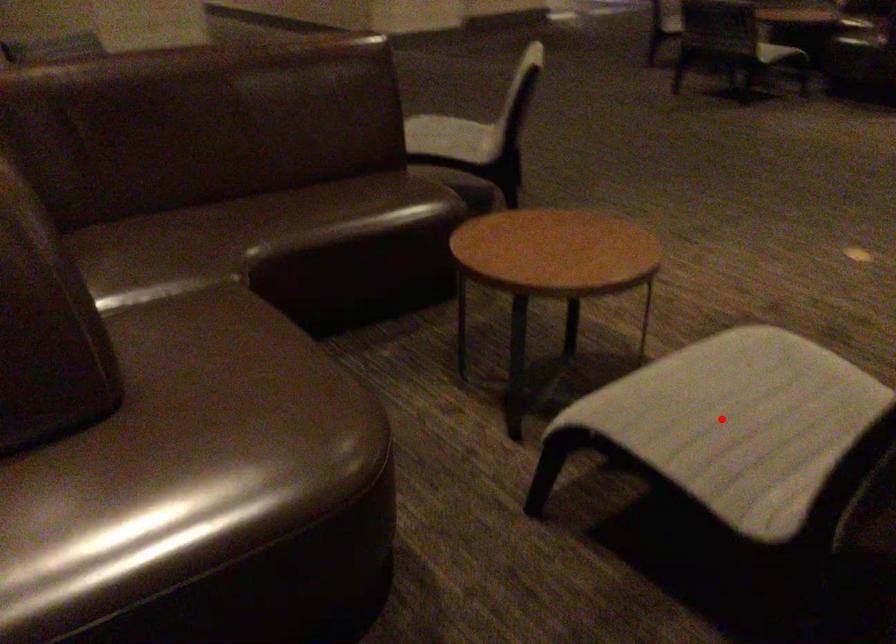
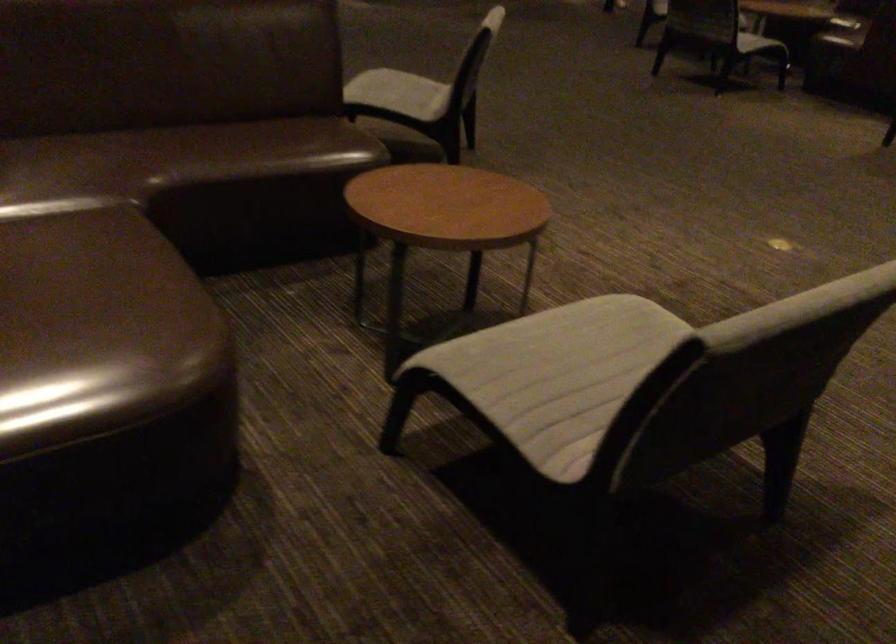
In the second image, find the point that corresponds to the highlighted location in the first image.

(557, 374)